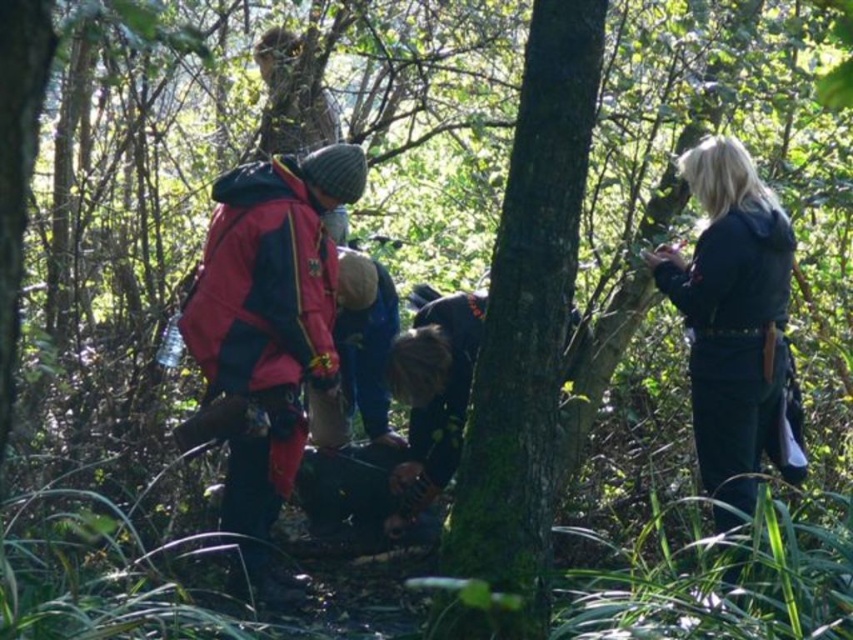
Question: Among these objects, which one is nearest to the camera?

Choices:
 (A) green mossy tree at center
 (B) red fabric jacket at center
 (C) black matte jacket at right

Answer: (A)

Question: Which of the following is the closest to the observer?

Choices:
 (A) red fabric jacket at center
 (B) green mossy tree at center
 (C) black matte jacket at right

Answer: (B)

Question: Can you confirm if green mossy tree at center is positioned above red fabric jacket at center?

Choices:
 (A) yes
 (B) no

Answer: (A)

Question: Does green mossy tree at center lie in front of black matte jacket at right?

Choices:
 (A) no
 (B) yes

Answer: (B)

Question: Which object is positioned farthest from the red fabric jacket at center?

Choices:
 (A) green mossy tree at center
 (B) black matte jacket at right

Answer: (B)

Question: Is green mossy tree at center to the right of black matte jacket at right from the viewer's perspective?

Choices:
 (A) yes
 (B) no

Answer: (B)